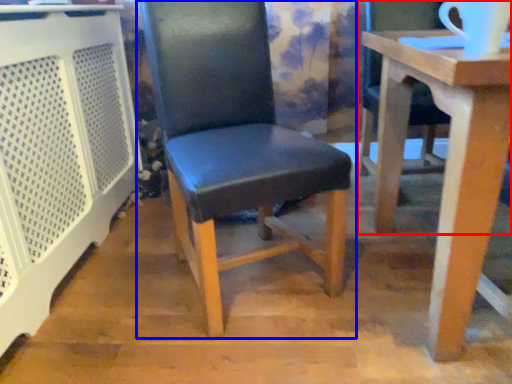
Question: Which of the following is the farthest to the observer, chair (highlighted by a red box) or chair (highlighted by a blue box)?

Choices:
 (A) chair
 (B) chair

Answer: (B)